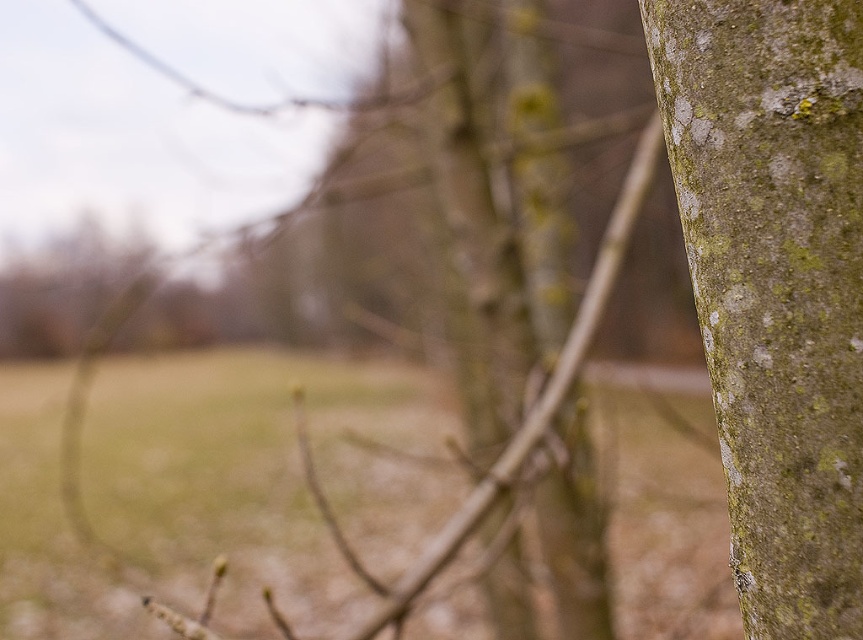
Between point (726, 3) and point (76, 499), which one is positioned behind?

The point (76, 499) is behind.

Is green mossy bark at right taller than green mossy bark at upper right?

No, green mossy bark at right is not taller than green mossy bark at upper right.

Who is more forward, (x=785, y=364) or (x=444, y=541)?

Point (x=785, y=364) is in front.

Locate an element on the screen. The height and width of the screenshot is (640, 863). green mossy bark at right is located at coordinates (775, 284).